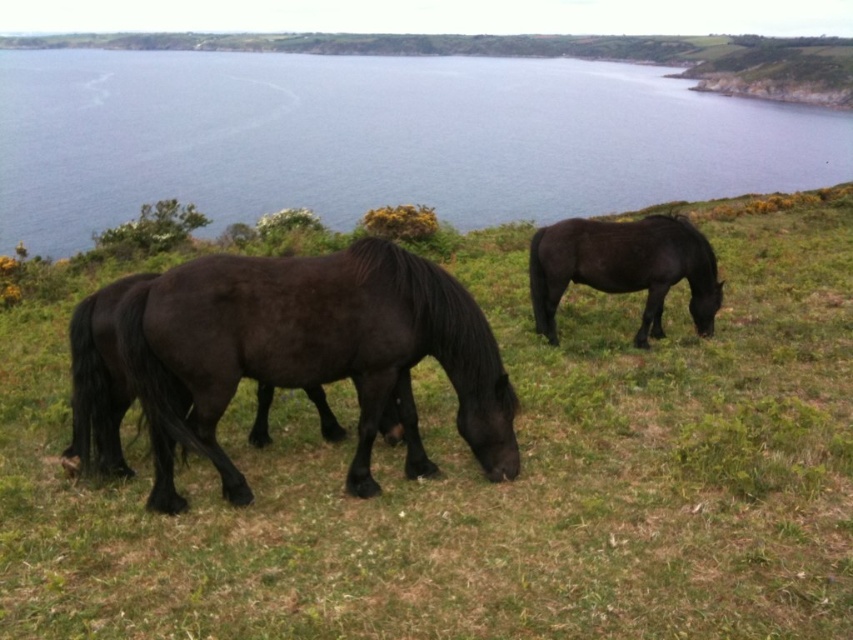
Question: Estimate the real-world distances between objects in this image. Which object is closer to the shiny black horse at center?

Choices:
 (A) blue water at upper center
 (B) green grass at center
 (C) black glossy horse at center

Answer: (B)

Question: Where is green grass at center located in relation to blue water at upper center in the image?

Choices:
 (A) left
 (B) right

Answer: (B)

Question: Which point is closer to the camera?

Choices:
 (A) shiny black horse at center
 (B) blue water at upper center

Answer: (A)

Question: Is shiny black horse at center thinner than black glossy horse at center?

Choices:
 (A) yes
 (B) no

Answer: (B)

Question: Which of the following is the closest to the observer?

Choices:
 (A) (485, 445)
 (B) (602, 244)
 (C) (351, 195)

Answer: (A)

Question: Does green grass at center have a smaller size compared to blue water at upper center?

Choices:
 (A) yes
 (B) no

Answer: (A)